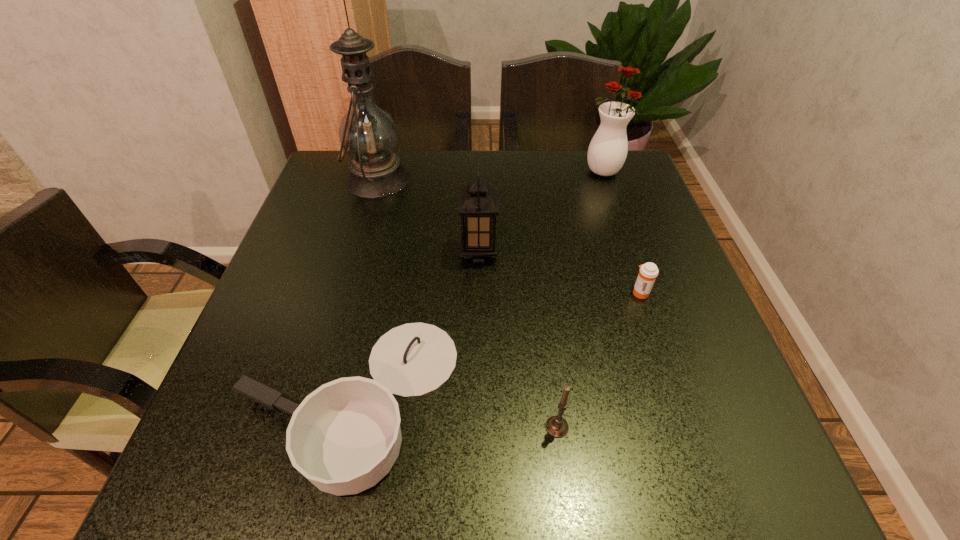
Select which object is the closest to the saucepan. Please provide its 2D coordinates. Your answer should be formatted as a tuple, i.e. [(x, y)], where the tuple contains the x and y coordinates of a point satisfying the conditions above.

[(556, 426)]

At what (x,y) coordinates should I click in order to perform the action: click on vacant space that satisfies the following two spatial constraints: 1. on the back side of the candle; 2. on the left side of the vase. Please return your answer as a coordinate pair (x, y). The width and height of the screenshot is (960, 540). Looking at the image, I should click on (524, 171).

Find the location of a particular element. This screenshot has width=960, height=540. vacant point that satisfies the following two spatial constraints: 1. on the back side of the lantern; 2. on the left side of the vase is located at coordinates (479, 171).

At what (x,y) coordinates should I click in order to perform the action: click on blank space that satisfies the following two spatial constraints: 1. on the back side of the oil lamp; 2. on the left side of the vase. Please return your answer as a coordinate pair (x, y). Looking at the image, I should click on 380,171.

Locate an element on the screen. free space that satisfies the following two spatial constraints: 1. on the front side of the lantern; 2. on the left side of the third nearest object is located at coordinates pyautogui.click(x=479, y=292).

This screenshot has width=960, height=540. In order to click on vacant region that satisfies the following two spatial constraints: 1. on the back side of the saucepan; 2. on the left side of the fourth nearest object in this screenshot , I will do `click(382, 253)`.